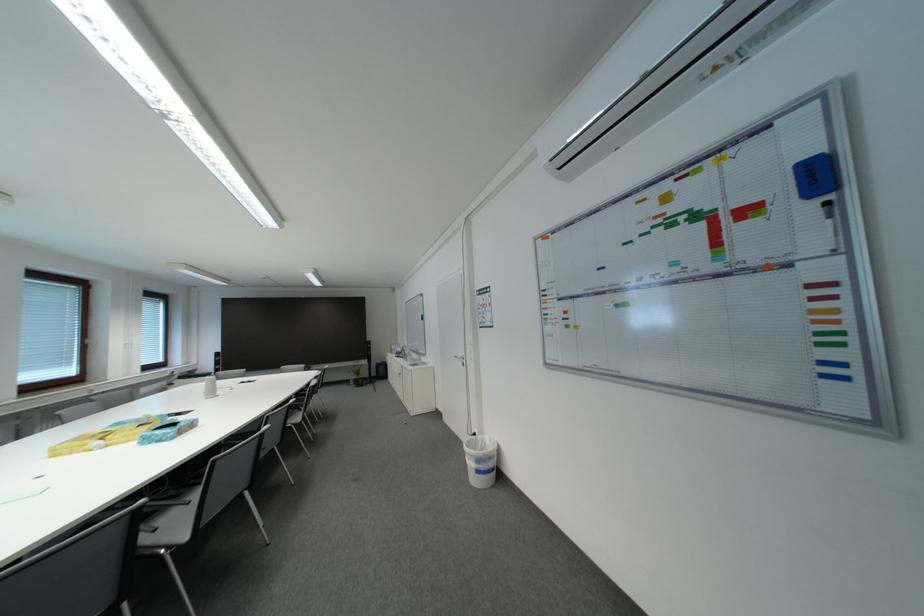
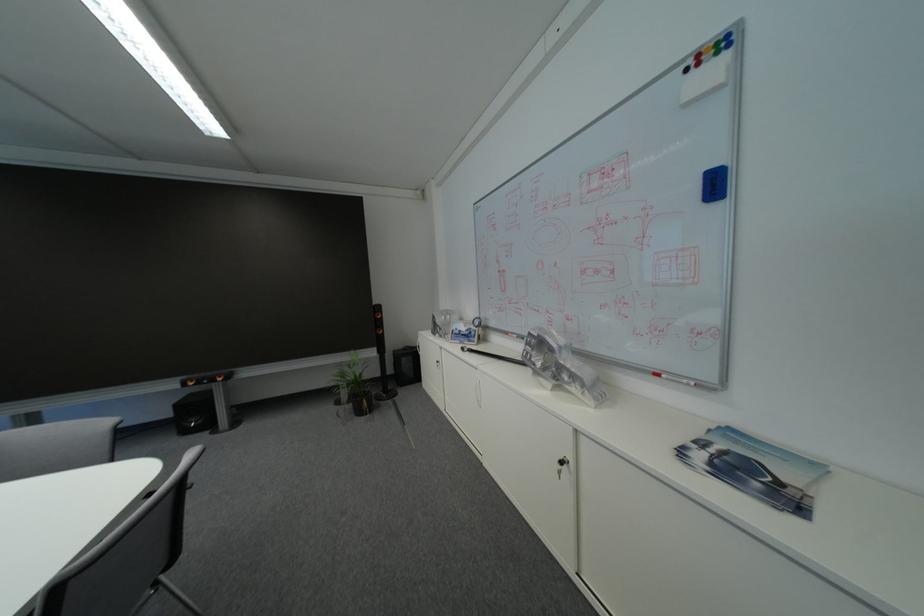
Find the pixel in the second image that matches the point at 375,365 in the first image.

(382, 355)